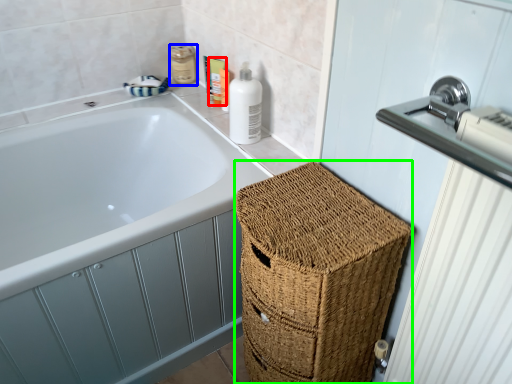
Question: Which is nearer to the toiletry (highlighted by a red box)? toiletry (highlighted by a blue box) or basket (highlighted by a green box).

Choices:
 (A) toiletry
 (B) basket

Answer: (A)